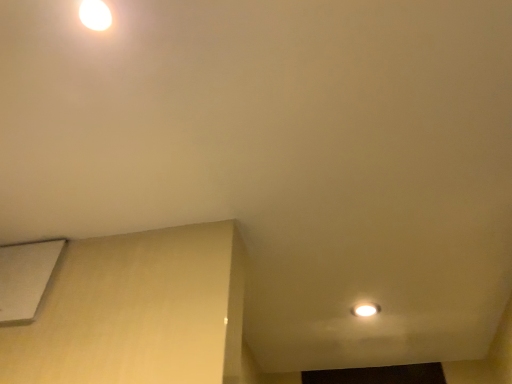
Measure the distance between white matte lift at lower left and camera.

white matte lift at lower left and camera are 1.07 meters apart.

The height and width of the screenshot is (384, 512). What do you see at coordinates (26, 278) in the screenshot? I see `white matte lift at lower left` at bounding box center [26, 278].

Locate an element on the screen. Image resolution: width=512 pixels, height=384 pixels. white matte lift at lower left is located at coordinates pos(26,278).

What are the coordinates of `white glossy light fixture at upper left` in the screenshot? It's located at (95, 15).

Image resolution: width=512 pixels, height=384 pixels. What do you see at coordinates (95, 15) in the screenshot?
I see `white glossy light fixture at upper left` at bounding box center [95, 15].

Identify the location of white matte lift at lower left. The image size is (512, 384). (26, 278).

Considering the positions of objects white glossy light fixture at upper left and white matte lift at lower left in the image provided, who is more to the left, white glossy light fixture at upper left or white matte lift at lower left?

Positioned to the left is white matte lift at lower left.

Does white glossy light fixture at upper left lie in front of white matte lift at lower left?

Yes, it is.

Which is behind, point (106, 21) or point (21, 296)?

The point (21, 296) is farther.

From the image's perspective, does white glossy light fixture at upper left appear lower than white matte lift at lower left?

No, from the image's perspective, white glossy light fixture at upper left is not beneath white matte lift at lower left.

From a real-world perspective, who is located higher, white glossy light fixture at upper left or white matte lift at lower left?

In real-world perspective, white glossy light fixture at upper left is above.

Considering the sizes of objects white glossy light fixture at upper left and white matte lift at lower left in the image provided, who is wider, white glossy light fixture at upper left or white matte lift at lower left?

Wider between the two is white glossy light fixture at upper left.

Between white glossy light fixture at upper left and white matte lift at lower left, which one has more height?

white matte lift at lower left.

Considering the relative sizes of white glossy light fixture at upper left and white matte lift at lower left in the image provided, is white glossy light fixture at upper left smaller than white matte lift at lower left?

Correct, white glossy light fixture at upper left occupies less space than white matte lift at lower left.

Is white glossy light fixture at upper left situated inside white matte lift at lower left or outside?

white glossy light fixture at upper left is not inside white matte lift at lower left, it's outside.

Is there a large distance between white glossy light fixture at upper left and white matte lift at lower left?

They are positioned close to each other.

Is white glossy light fixture at upper left looking in the opposite direction of white matte lift at lower left?

No.

How many degrees apart are the facing directions of white glossy light fixture at upper left and white matte lift at lower left?

91 degrees.

Identify the location of lift on the left of white glossy light fixture at upper left. point(26,278).

Does white matte lift at lower left appear on the right side of white glossy light fixture at upper left?

No.

Does white matte lift at lower left lie in front of white glossy light fixture at upper left?

No, it is behind white glossy light fixture at upper left.

Is point (20, 291) behind point (95, 6)?

Yes.

From the image's perspective, is white matte lift at lower left located above or below white glossy light fixture at upper left?

Based on their image positions, white matte lift at lower left is located beneath white glossy light fixture at upper left.

From a real-world perspective, which object stands above the other?

white glossy light fixture at upper left, from a real-world perspective.

Between white matte lift at lower left and white glossy light fixture at upper left, which one has larger width?

white glossy light fixture at upper left is wider.

Is white matte lift at lower left taller than white glossy light fixture at upper left?

Yes.

Considering the sizes of objects white matte lift at lower left and white glossy light fixture at upper left in the image provided, who is bigger, white matte lift at lower left or white glossy light fixture at upper left?

white matte lift at lower left is bigger.

Which is correct: white matte lift at lower left is inside white glossy light fixture at upper left, or outside of it?

white matte lift at lower left is not enclosed by white glossy light fixture at upper left.

Based on the photo, is white matte lift at lower left not near white glossy light fixture at upper left?

No.

Is white matte lift at lower left facing away from white glossy light fixture at upper left?

white matte lift at lower left is not turned away from white glossy light fixture at upper left.

Looking at this image, how many degrees apart are the facing directions of white matte lift at lower left and white glossy light fixture at upper left?

The angle between the facing direction of white matte lift at lower left and the facing direction of white glossy light fixture at upper left is 91 degrees.

How distant is white matte lift at lower left from white glossy light fixture at upper left?

white matte lift at lower left is 29.10 inches away from white glossy light fixture at upper left.

You are a GUI agent. You are given a task and a screenshot of the screen. Output one action in this format:
    pyautogui.click(x=<x>, y=<y>)
    Task: Click on the lamp in front of the white matte lift at lower left
    The width and height of the screenshot is (512, 384).
    Given the screenshot: What is the action you would take?
    pyautogui.click(x=95, y=15)

This screenshot has height=384, width=512. I want to click on lift that is below the white glossy light fixture at upper left (from the image's perspective), so click(26, 278).

Where is `lamp that appears in front of the white matte lift at lower left`? lamp that appears in front of the white matte lift at lower left is located at coordinates (95, 15).